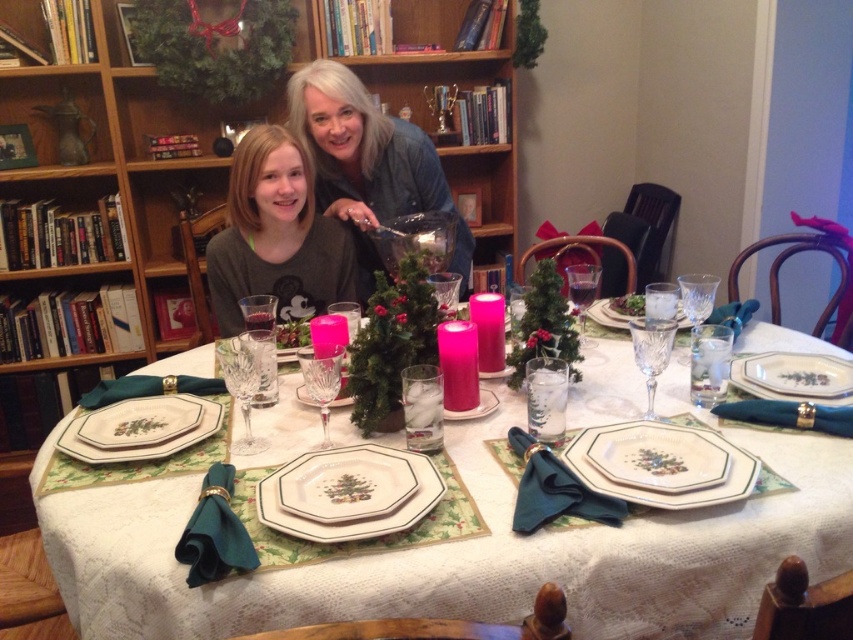
You are a photographer standing at the camera position. You need to capture a closeup shot of the matte gray shirt at center without moving any objects. Can you do it with your current position?

The matte gray shirt at center is 1.92 meters from camera, so yes, you can capture a closeup shot from your current position as 1.92 meters is a suitable distance for a closeup.

What are the coordinates of the matte gray shirt at center?

The coordinates of the matte gray shirt at center are at point (276, 236).

You are standing at the entrance of the dining area and want to locate the point at coordinates point [107,224]. Based on the scene description, where would this point be located?

The point [107,224] is on the wooden bookshelf at upper left.